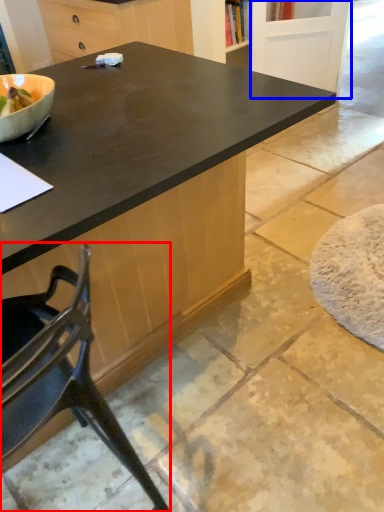
Question: Which point is closer to the camera, chair (highlighted by a red box) or screen door (highlighted by a blue box)?

Choices:
 (A) chair
 (B) screen door

Answer: (A)